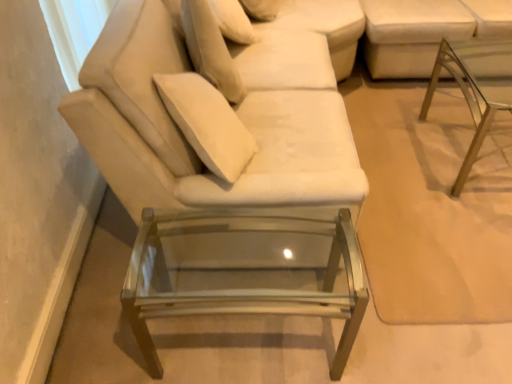
Question: Is velvet beige couch at center next to white fabric couch at upper right and touching it?

Choices:
 (A) yes
 (B) no

Answer: (B)

Question: Considering the relative positions of velvet beige couch at center and white fabric couch at upper right in the image provided, is velvet beige couch at center in front of white fabric couch at upper right?

Choices:
 (A) yes
 (B) no

Answer: (A)

Question: From the image's perspective, is velvet beige couch at center over white fabric couch at upper right?

Choices:
 (A) no
 (B) yes

Answer: (A)

Question: Considering the relative sizes of velvet beige couch at center and white fabric couch at upper right in the image provided, is velvet beige couch at center wider than white fabric couch at upper right?

Choices:
 (A) yes
 (B) no

Answer: (B)

Question: Is velvet beige couch at center bigger than white fabric couch at upper right?

Choices:
 (A) no
 (B) yes

Answer: (B)

Question: Is white fabric couch at upper right a part of velvet beige couch at center?

Choices:
 (A) no
 (B) yes

Answer: (A)

Question: Considering the relative sizes of velvet beige couch at center and clear glass table at lower center, acting as the first table starting from the left, in the image provided, is velvet beige couch at center wider than clear glass table at lower center, acting as the first table starting from the left,?

Choices:
 (A) yes
 (B) no

Answer: (A)

Question: From a real-world perspective, is velvet beige couch at center on clear glass table at lower center, which is the 2th table in right-to-left order?

Choices:
 (A) yes
 (B) no

Answer: (A)

Question: Is velvet beige couch at center placed right next to clear glass table at lower center, which appears as the second table when viewed from the top?

Choices:
 (A) yes
 (B) no

Answer: (B)

Question: Does velvet beige couch at center have a lesser width compared to clear glass table at lower center, acting as the first table starting from the left?

Choices:
 (A) no
 (B) yes

Answer: (A)

Question: Does velvet beige couch at center turn towards clear glass table at lower center, which is the 1th table from bottom to top?

Choices:
 (A) yes
 (B) no

Answer: (B)

Question: Is velvet beige couch at center to the right of clear glass table at lower center, which appears as the second table when viewed from the top, from the viewer's perspective?

Choices:
 (A) no
 (B) yes

Answer: (A)

Question: Is velvet beige pillow at upper center to the left of clear glass table at lower center, acting as the first table starting from the left, from the viewer's perspective?

Choices:
 (A) no
 (B) yes

Answer: (B)